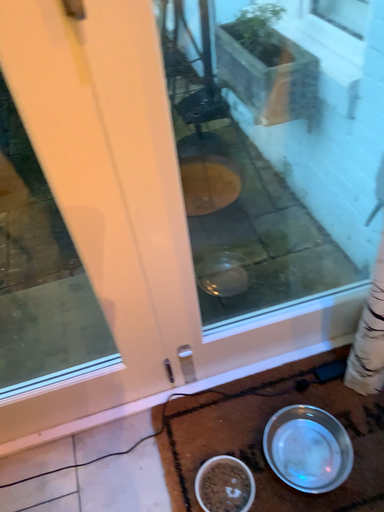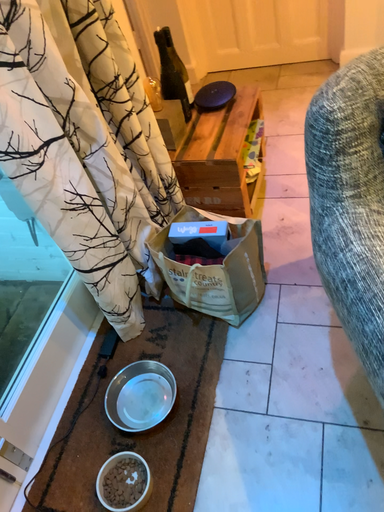
Question: Which way did the camera rotate in the video?

Choices:
 (A) rotated downward
 (B) rotated upward

Answer: (B)